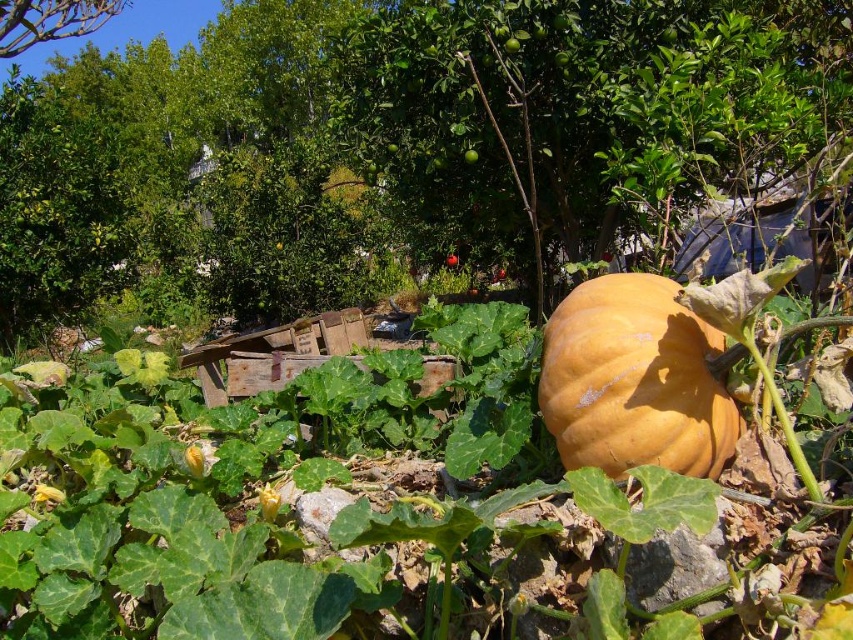
Does orange matte pumpkin at center appear on the left side of green leafy tree at upper left?

No, orange matte pumpkin at center is not to the left of green leafy tree at upper left.

Between point (659, 328) and point (96, 20), which one is positioned in front?

Positioned in front is point (659, 328).

Identify the location of orange matte pumpkin at center. The width and height of the screenshot is (853, 640). (634, 380).